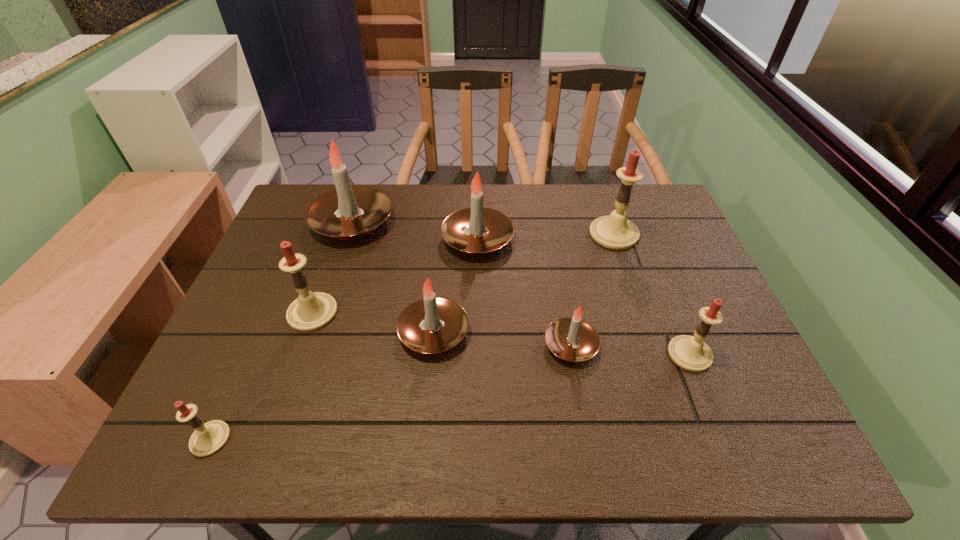
Locate an element on the screen. The width and height of the screenshot is (960, 540). the smallest red candle is located at coordinates (208, 438).

This screenshot has width=960, height=540. I want to click on free space located on the front of the leftmost white candle, so click(311, 348).

This screenshot has height=540, width=960. Identify the location of vacant region located 0.400m on the front of the biggest red candle. (660, 372).

I want to click on vacant space located 0.140m on the left of the third smallest white candle, so click(x=394, y=239).

I want to click on vacant space located on the back of the second farthest red candle, so click(339, 239).

Locate an element on the screen. This screenshot has width=960, height=540. vacant position located 0.300m on the left of the third farthest red candle is located at coordinates (536, 354).

You are a GUI agent. You are given a task and a screenshot of the screen. Output one action in this format:
    pyautogui.click(x=<x>, y=<y>)
    Task: Click on the vacant space located on the right of the third biggest white candle
    The height and width of the screenshot is (540, 960).
    Given the screenshot: What is the action you would take?
    pyautogui.click(x=533, y=332)

Identify the location of free spot located 0.200m on the left of the sixth candle from left to right. (457, 345).

Locate an element on the screen. vacant space positioned 0.140m on the right of the nearest candle is located at coordinates (300, 438).

You are a GUI agent. You are given a task and a screenshot of the screen. Output one action in this format:
    pyautogui.click(x=<x>, y=<y>)
    Task: Click on the object that is at the near edge
    The image size is (960, 540).
    Given the screenshot: What is the action you would take?
    pyautogui.click(x=208, y=438)